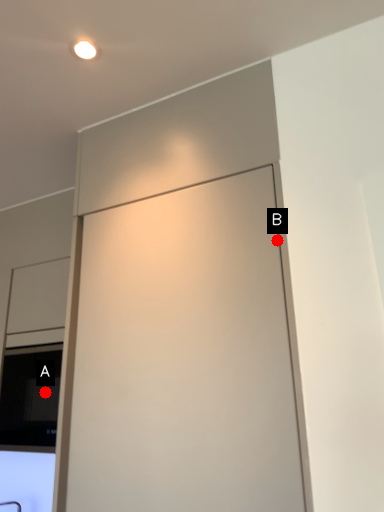
Question: Two points are circled on the image, labeled by A and B beside each circle. Which point is farther from the camera taking this photo?

Choices:
 (A) A is further
 (B) B is further

Answer: (A)